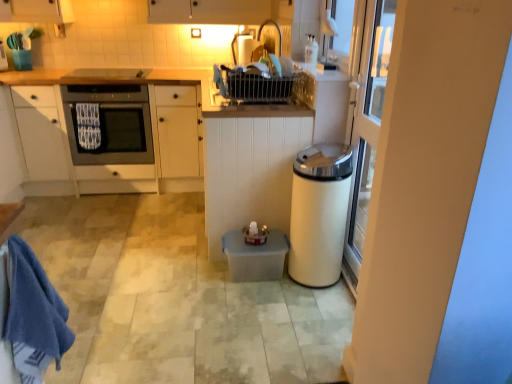
You are a GUI agent. You are given a task and a screenshot of the screen. Output one action in this format:
    pyautogui.click(x=<x>, y=<y>)
    Task: Click on the matte black oven at left
    
    Given the screenshot: What is the action you would take?
    pyautogui.click(x=111, y=123)

The image size is (512, 384). Describe the element at coordinates (109, 107) in the screenshot. I see `white matte cabinet at left, positioned as the 2th cabinetry in right-to-left order` at that location.

Measure the distance between white matte cabinet at left, positioned as the 2th cabinetry in right-to-left order, and camera.

white matte cabinet at left, positioned as the 2th cabinetry in right-to-left order, is 9.67 feet away from camera.

This screenshot has width=512, height=384. What do you see at coordinates (249, 172) in the screenshot?
I see `white matte cabinet at center, positioned as the 2th cabinetry in left-to-right order` at bounding box center [249, 172].

Describe the element at coordinates (319, 213) in the screenshot. I see `white glossy trash can at right` at that location.

I want to click on blue cotton towel at lower left, the second bath towel viewed from the top, so click(x=33, y=314).

Considering the relative sizes of translucent plastic container at center and white glossy trash can at right in the image provided, is translucent plastic container at center taller than white glossy trash can at right?

Incorrect, the height of translucent plastic container at center is not larger of that of white glossy trash can at right.

Is translucent plastic container at center positioned with its back to white glossy trash can at right?

Absolutely, translucent plastic container at center is directed away from white glossy trash can at right.

From a real-world perspective, who is located higher, translucent plastic container at center or white glossy trash can at right?

In real-world perspective, white glossy trash can at right is above.

Is translucent plastic container at center inside the boundaries of white glossy trash can at right, or outside?

translucent plastic container at center is spatially situated outside white glossy trash can at right.

Considering the positions of objects white glossy trash can at right and translucent plastic container at center in the image provided, who is more to the right, white glossy trash can at right or translucent plastic container at center?

white glossy trash can at right is more to the right.

Which point is more distant from viewer, (348,174) or (247,266)?

The point (247,266) is behind.

From a real-world perspective, who is located higher, white glossy trash can at right or translucent plastic container at center?

white glossy trash can at right.

Where is `water heater lying below the white glossy trash can at right (from the image's perspective)`? water heater lying below the white glossy trash can at right (from the image's perspective) is located at coordinates (255, 256).

From a real-world perspective, is white textured bath towel at left, the first bath towel positioned from the left, on top of matte black oven at upper center?

Incorrect, from a real-world perspective, white textured bath towel at left, the first bath towel positioned from the left, is lower than matte black oven at upper center.

From the image's perspective, is white textured bath towel at left, the first bath towel positioned from the left, beneath matte black oven at upper center?

Correct, white textured bath towel at left, the first bath towel positioned from the left, appears lower than matte black oven at upper center in the image.

Is white textured bath towel at left, which is the 2th bath towel from front to back, completely or partially outside of matte black oven at upper center?

Yes.

Would you say blue cotton towel at lower left, the second bath towel viewed from the top, is inside or outside matte black oven at upper center?

blue cotton towel at lower left, the second bath towel viewed from the top, is located beyond the bounds of matte black oven at upper center.

Is matte black oven at upper center at the back of blue cotton towel at lower left, positioned as the second bath towel in left-to-right order?

blue cotton towel at lower left, positioned as the second bath towel in left-to-right order, is not turned away from matte black oven at upper center.

Looking at this image, does blue cotton towel at lower left, positioned as the second bath towel in left-to-right order, appear on the left side of matte black oven at upper center?

No.

What's the angular difference between blue cotton towel at lower left, placed as the 1th bath towel when sorted from front to back, and matte black oven at upper center's facing directions?

The facing directions of blue cotton towel at lower left, placed as the 1th bath towel when sorted from front to back, and matte black oven at upper center are 179 degrees apart.

Could white matte cabinet at left, which is the 1th cabinetry in left-to-right order, be considered to be inside white glossy trash can at right?

No, white matte cabinet at left, which is the 1th cabinetry in left-to-right order, is not a part of white glossy trash can at right.

From a real-world perspective, does white glossy trash can at right sit lower than white matte cabinet at left, which is the 1th cabinetry in left-to-right order?

Correct, in the physical world, white glossy trash can at right is lower than white matte cabinet at left, which is the 1th cabinetry in left-to-right order.

Is white glossy trash can at right aimed at white matte cabinet at left, positioned as the 2th cabinetry in right-to-left order?

No, white glossy trash can at right is not oriented towards white matte cabinet at left, positioned as the 2th cabinetry in right-to-left order.

Is matte black oven at upper center smaller than white matte cabinet at center, positioned as the 2th cabinetry in left-to-right order?

Indeed, matte black oven at upper center has a smaller size compared to white matte cabinet at center, positioned as the 2th cabinetry in left-to-right order.

Is the depth of matte black oven at upper center greater than that of white matte cabinet at center, positioned as the 2th cabinetry in left-to-right order?

Yes, matte black oven at upper center is further from the camera.

Image resolution: width=512 pixels, height=384 pixels. What are the coordinates of `the 2nd cabinetry below the matte black oven at upper center (from a real-world perspective)` in the screenshot? It's located at (249, 172).

From the picture: Which object is wider, matte black oven at upper center or white matte cabinet at center, the 1th cabinetry viewed from the right?

white matte cabinet at center, the 1th cabinetry viewed from the right.

Which is more to the right, matte black oven at left or blue cotton towel at lower left, which is counted as the 1th bath towel, starting from the right?

blue cotton towel at lower left, which is counted as the 1th bath towel, starting from the right.

Based on the photo, would you say matte black oven at left contains blue cotton towel at lower left, the second bath towel viewed from the top?

No, matte black oven at left does not contain blue cotton towel at lower left, the second bath towel viewed from the top.

What's the angular difference between matte black oven at left and blue cotton towel at lower left, positioned as the second bath towel in left-to-right order,'s facing directions?

The facing directions of matte black oven at left and blue cotton towel at lower left, positioned as the second bath towel in left-to-right order, are 179 degrees apart.

Identify the location of water heater lying behind the white glossy trash can at right. The height and width of the screenshot is (384, 512). coord(255,256).

Find the location of a particular element. kitchen appliance to the right of translucent plastic container at center is located at coordinates (319, 213).

Looking at this image, looking at the image, which one is located closer to matte black oven at left, white glossy trash can at right or white matte cabinet at left, which is the 1th cabinetry in left-to-right order?

Among the two, white matte cabinet at left, which is the 1th cabinetry in left-to-right order, is located nearer to matte black oven at left.

When comparing their distances from white textured bath towel at left, which ranks as the 1th bath towel in back-to-front order, does translucent plastic container at center or white matte cabinet at left, which is the 1th cabinetry in left-to-right order, seem closer?

white matte cabinet at left, which is the 1th cabinetry in left-to-right order, is closer to white textured bath towel at left, which ranks as the 1th bath towel in back-to-front order.

Looking at this image, considering their positions, is matte black oven at upper center positioned closer to blue cotton towel at lower left, the second bath towel viewed from the top, than translucent plastic container at center?

Based on the image, translucent plastic container at center appears to be nearer to blue cotton towel at lower left, the second bath towel viewed from the top.

Based on their spatial positions, is white glossy trash can at right or white matte cabinet at left, positioned as the 2th cabinetry in right-to-left order, closer to white textured bath towel at left, the first bath towel positioned from the left?

Among the two, white matte cabinet at left, positioned as the 2th cabinetry in right-to-left order, is located nearer to white textured bath towel at left, the first bath towel positioned from the left.

Estimate the real-world distances between objects in this image. Which object is closer to white glossy trash can at right, white matte cabinet at left, which is the 1th cabinetry in left-to-right order, or white textured bath towel at left, the 2th bath towel positioned from the right?

The object closer to white glossy trash can at right is white matte cabinet at left, which is the 1th cabinetry in left-to-right order.

From the image, which object appears to be farther from matte black oven at upper center, white matte cabinet at center, the 1th cabinetry viewed from the right, or translucent plastic container at center?

translucent plastic container at center is further to matte black oven at upper center.

Considering their positions, is translucent plastic container at center positioned closer to white glossy trash can at right than white textured bath towel at left, which ranks as the 1th bath towel in back-to-front order?

The object closer to white glossy trash can at right is translucent plastic container at center.

In the scene shown: Which object lies further to the anchor point white matte cabinet at center, the 1th cabinetry viewed from the right, matte black oven at upper center or matte black oven at left?

matte black oven at upper center lies further to white matte cabinet at center, the 1th cabinetry viewed from the right, than the other object.

The height and width of the screenshot is (384, 512). I want to click on water heater located between matte black oven at upper center and white glossy trash can at right in the left-right direction, so click(255, 256).

Where is `home appliance between white matte cabinet at left, positioned as the 2th cabinetry in right-to-left order, and white glossy trash can at right`? home appliance between white matte cabinet at left, positioned as the 2th cabinetry in right-to-left order, and white glossy trash can at right is located at coordinates (111, 123).

You are a GUI agent. You are given a task and a screenshot of the screen. Output one action in this format:
    pyautogui.click(x=<x>, y=<y>)
    Task: Click on the bath towel between white matte cabinet at left, which is the 1th cabinetry in left-to-right order, and matte black oven at left from left to right
    
    Given the screenshot: What is the action you would take?
    pyautogui.click(x=88, y=126)

In order to click on cabinetry between matte black oven at left and translucent plastic container at center in this screenshot , I will do `click(249, 172)`.